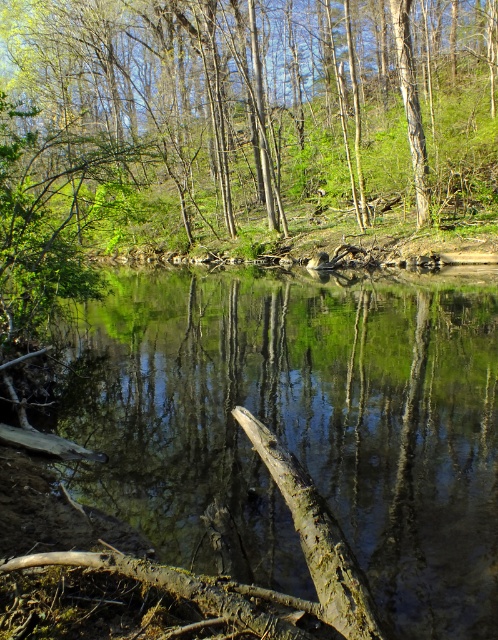
Between point (395, 600) and point (56, 20), which one is positioned behind?

Point (56, 20)

This screenshot has width=498, height=640. What do you see at coordinates (299, 426) in the screenshot?
I see `brown muddy river at center` at bounding box center [299, 426].

You are a GUI agent. You are given a task and a screenshot of the screen. Output one action in this format:
    pyautogui.click(x=<x>, y=<y>)
    Task: Click on the brown muddy river at center
    This screenshot has width=498, height=640.
    Given the screenshot: What is the action you would take?
    pyautogui.click(x=299, y=426)